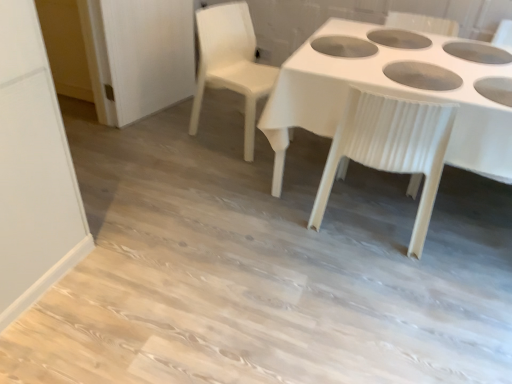
Image resolution: width=512 pixels, height=384 pixels. Find the location of `white plastic chair at center, arranged as the 1th chair when viewed from the right`. white plastic chair at center, arranged as the 1th chair when viewed from the right is located at coordinates click(x=391, y=148).

Between white plastic chair at center, arranged as the 1th chair when viewed from the right, and white plastic chair at upper center, positioned as the second chair in right-to-left order, which one appears on the left side from the viewer's perspective?

white plastic chair at upper center, positioned as the second chair in right-to-left order.

Which is behind, white plastic chair at center, arranged as the 1th chair when viewed from the right, or white plastic chair at upper center, positioned as the second chair in right-to-left order?

white plastic chair at upper center, positioned as the second chair in right-to-left order.

From a real-world perspective, is white plastic chair at center, arranged as the 1th chair when viewed from the right, positioned above or below white plastic chair at upper center, the first chair from the left?

Result: white plastic chair at center, arranged as the 1th chair when viewed from the right, is above white plastic chair at upper center, the first chair from the left.

Which of these two, white plastic chair at center, the second chair positioned from the left, or white plastic chair at upper center, positioned as the second chair in right-to-left order, is smaller?

Smaller between the two is white plastic chair at upper center, positioned as the second chair in right-to-left order.

Is white plastic chair at upper center, positioned as the second chair in right-to-left order, turned away from white plastic table at center?

That's not correct — white plastic chair at upper center, positioned as the second chair in right-to-left order, is not looking away from white plastic table at center.

In the scene shown: Is white plastic chair at upper center, the first chair from the left, not inside white plastic table at center?

Yes, white plastic chair at upper center, the first chair from the left, is not within white plastic table at center.

Can you confirm if white plastic chair at upper center, the first chair from the left, is bigger than white plastic table at center?

No, white plastic chair at upper center, the first chair from the left, is not bigger than white plastic table at center.

Does white plastic chair at upper center, the first chair from the left, appear on the left side of white plastic table at center?

Correct, you'll find white plastic chair at upper center, the first chair from the left, to the left of white plastic table at center.

Can you confirm if white plastic chair at center, the second chair positioned from the left, is bigger than white plastic table at center?

No, white plastic chair at center, the second chair positioned from the left, is not bigger than white plastic table at center.

From a real-world perspective, is white plastic chair at center, arranged as the 1th chair when viewed from the right, positioned above or below white plastic table at center?

white plastic chair at center, arranged as the 1th chair when viewed from the right, is situated higher than white plastic table at center in the real world.

Relative to white plastic table at center, is white plastic chair at center, arranged as the 1th chair when viewed from the right, in front or behind?

white plastic chair at center, arranged as the 1th chair when viewed from the right, is behind white plastic table at center.

From the image's perspective, is white plastic chair at center, arranged as the 1th chair when viewed from the right, above or below white plastic table at center?

Clearly, from the image's perspective, white plastic chair at center, arranged as the 1th chair when viewed from the right, is below white plastic table at center.

Considering the positions of points (372, 68) and (324, 170), is point (372, 68) closer to camera compared to point (324, 170)?

Yes, it is.

Considering the relative sizes of white plastic table at center and white plastic chair at center, arranged as the 1th chair when viewed from the right, in the image provided, is white plastic table at center wider than white plastic chair at center, arranged as the 1th chair when viewed from the right,?

Yes.

Based on the photo, from the image's perspective, is white plastic table at center over white plastic chair at center, arranged as the 1th chair when viewed from the right?

Yes.

Considering the relative sizes of white plastic table at center and white plastic chair at center, the second chair positioned from the left, in the image provided, is white plastic table at center smaller than white plastic chair at center, the second chair positioned from the left,?

Incorrect, white plastic table at center is not smaller in size than white plastic chair at center, the second chair positioned from the left.

At what (x,y) coordinates should I click in order to perform the action: click on chair to the left of white plastic chair at center, the second chair positioned from the left. Please return your answer as a coordinate pair (x, y). Looking at the image, I should click on (231, 63).

From a real-world perspective, is white plastic chair at upper center, positioned as the second chair in right-to-left order, under white plastic chair at center, arranged as the 1th chair when viewed from the right?

Correct, in the physical world, white plastic chair at upper center, positioned as the second chair in right-to-left order, is lower than white plastic chair at center, arranged as the 1th chair when viewed from the right.

Based on the photo, considering the relative sizes of white plastic chair at upper center, the first chair from the left, and white plastic chair at center, arranged as the 1th chair when viewed from the right, in the image provided, is white plastic chair at upper center, the first chair from the left, taller than white plastic chair at center, arranged as the 1th chair when viewed from the right,?

In fact, white plastic chair at upper center, the first chair from the left, may be shorter than white plastic chair at center, arranged as the 1th chair when viewed from the right.

Does point (192, 114) lie behind point (431, 184)?

Yes.

How different are the orientations of white plastic table at center and white plastic chair at upper center, the first chair from the left, in degrees?

The facing directions of white plastic table at center and white plastic chair at upper center, the first chair from the left, are 69.4 degrees apart.

Considering their positions, is white plastic table at center located in front of or behind white plastic chair at upper center, the first chair from the left?

In the image, white plastic table at center appears in front of white plastic chair at upper center, the first chair from the left.

Considering the points (338, 109) and (262, 95), which point is in front, point (338, 109) or point (262, 95)?

Positioned in front is point (338, 109).

Is white plastic table at center looking in the opposite direction of white plastic chair at upper center, the first chair from the left?

white plastic table at center does not have its back to white plastic chair at upper center, the first chair from the left.

Where is `chair located in front of the white plastic chair at upper center, positioned as the second chair in right-to-left order`? chair located in front of the white plastic chair at upper center, positioned as the second chair in right-to-left order is located at coordinates (391, 148).

I want to click on table that appears below the white plastic chair at upper center, the first chair from the left (from the image's perspective), so click(394, 91).

Looking at the image, which one is located closer to white plastic table at center, white plastic chair at upper center, the first chair from the left, or white plastic chair at center, arranged as the 1th chair when viewed from the right?

white plastic chair at center, arranged as the 1th chair when viewed from the right, lies closer to white plastic table at center than the other object.

From the image, which object appears to be nearer to white plastic chair at center, arranged as the 1th chair when viewed from the right, white plastic chair at upper center, the first chair from the left, or white plastic table at center?

Among the two, white plastic table at center is located nearer to white plastic chair at center, arranged as the 1th chair when viewed from the right.

Which object lies nearer to the anchor point white plastic table at center, white plastic chair at center, the second chair positioned from the left, or white plastic chair at upper center, the first chair from the left?

white plastic chair at center, the second chair positioned from the left.

Looking at this image, based on their spatial positions, is white plastic table at center or white plastic chair at upper center, positioned as the second chair in right-to-left order, further from white plastic chair at center, the second chair positioned from the left?

white plastic chair at upper center, positioned as the second chair in right-to-left order.

From the image, which object appears to be nearer to white plastic chair at upper center, positioned as the second chair in right-to-left order, white plastic chair at center, the second chair positioned from the left, or white plastic table at center?

The object closer to white plastic chair at upper center, positioned as the second chair in right-to-left order, is white plastic table at center.

From the picture: From the image, which object appears to be nearer to white plastic chair at upper center, positioned as the second chair in right-to-left order, white plastic table at center or white plastic chair at center, the second chair positioned from the left?

white plastic table at center.

Find the location of a particular element. The height and width of the screenshot is (384, 512). chair situated between white plastic chair at upper center, the first chair from the left, and white plastic table at center from left to right is located at coordinates (391, 148).